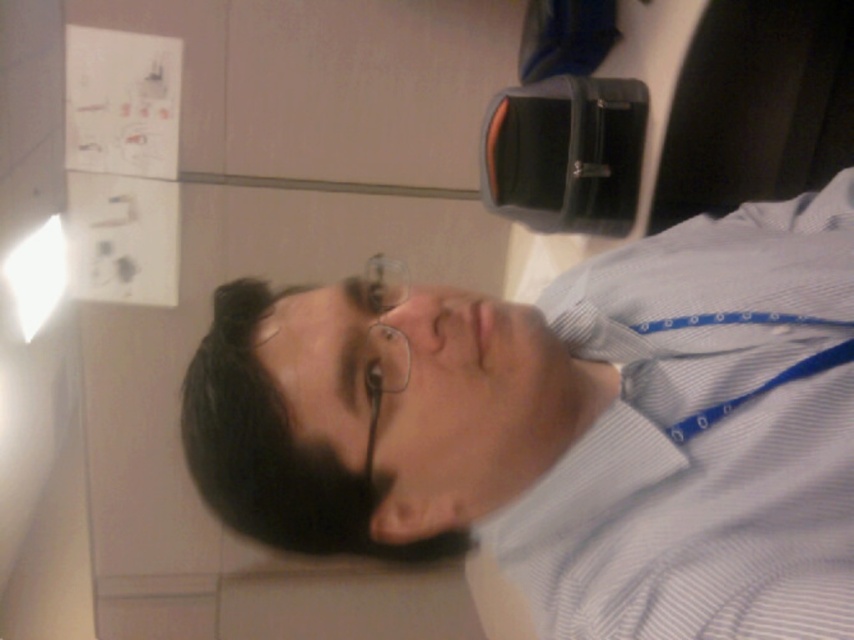
Question: From the image, what is the correct spatial relationship of white striped dress shirt at center in relation to clear plastic glasses at center?

Choices:
 (A) below
 (B) above

Answer: (A)

Question: Which point is closer to the camera taking this photo?

Choices:
 (A) (379, 401)
 (B) (847, 276)

Answer: (A)

Question: Among these points, which one is farthest from the camera?

Choices:
 (A) (390, 364)
 (B) (641, 413)

Answer: (B)

Question: Is white striped dress shirt at center below clear plastic glasses at center?

Choices:
 (A) yes
 (B) no

Answer: (A)

Question: Among these objects, which one is nearest to the camera?

Choices:
 (A) clear plastic glasses at center
 (B) white striped dress shirt at center

Answer: (B)

Question: Is white striped dress shirt at center above clear plastic glasses at center?

Choices:
 (A) no
 (B) yes

Answer: (A)